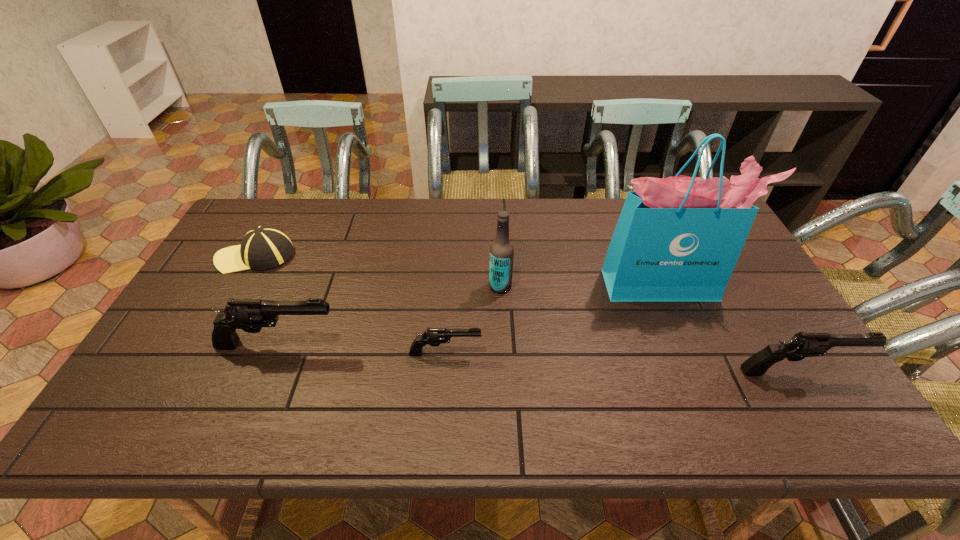
Find the location of a particular element. The image size is (960, 540). vacant point that satisfies the following two spatial constraints: 1. with the brim of the baseball cap facing forward; 2. on the back side of the tallest object is located at coordinates (240, 285).